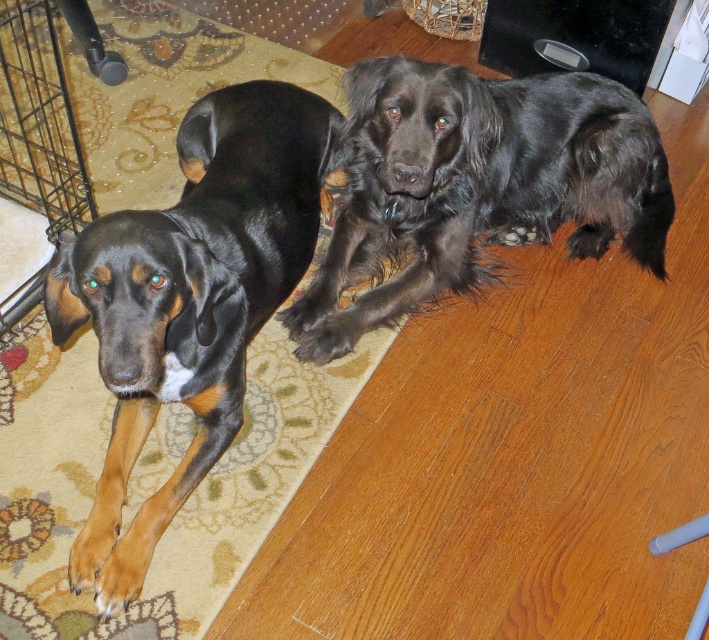
Image resolution: width=709 pixels, height=640 pixels. Describe the element at coordinates (189, 300) in the screenshot. I see `black glossy dog at left` at that location.

Between black glossy dog at left and shiny black dog at upper right, which one has more height?

With more height is black glossy dog at left.

Does point (186, 202) lie behind point (579, 243)?

No, (186, 202) is in front of (579, 243).

I want to click on black glossy dog at left, so click(x=189, y=300).